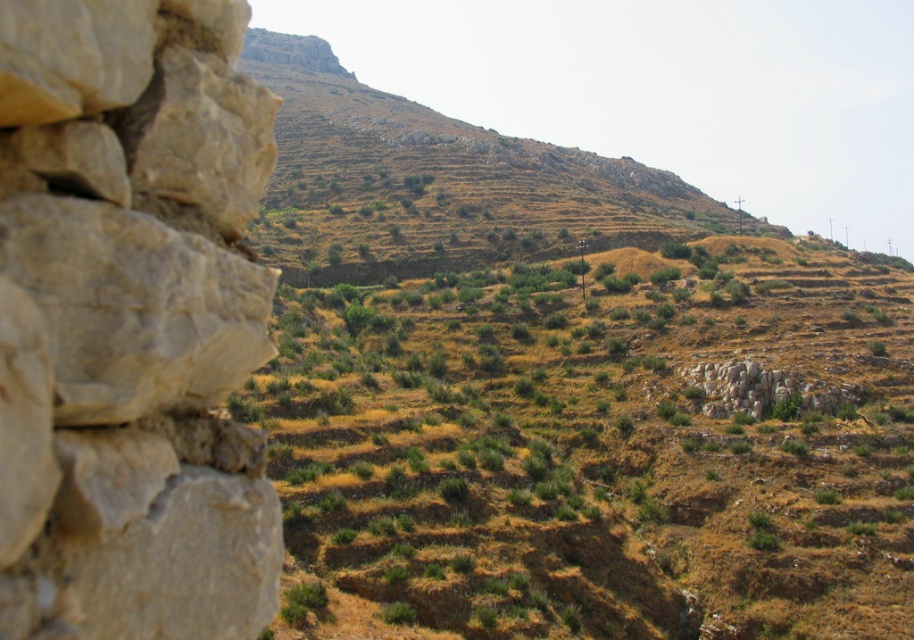
Question: Which point is closer to the camera?

Choices:
 (A) [560, 531]
 (B) [133, 246]

Answer: (B)

Question: Does natural beige stone at left have a larger size compared to brown textured hill at upper center?

Choices:
 (A) yes
 (B) no

Answer: (B)

Question: Does natural beige stone at left have a smaller size compared to brown textured hill at upper center?

Choices:
 (A) yes
 (B) no

Answer: (A)

Question: Which point is farther to the camera?

Choices:
 (A) brown textured hill at upper center
 (B) green grassy field at center
 (C) natural beige stone at left

Answer: (B)

Question: Which of these objects is positioned closest to the natural beige stone at left?

Choices:
 (A) green grassy field at center
 (B) brown textured hill at upper center

Answer: (A)

Question: Can you confirm if natural beige stone at left is positioned to the left of brown textured hill at upper center?

Choices:
 (A) no
 (B) yes

Answer: (B)